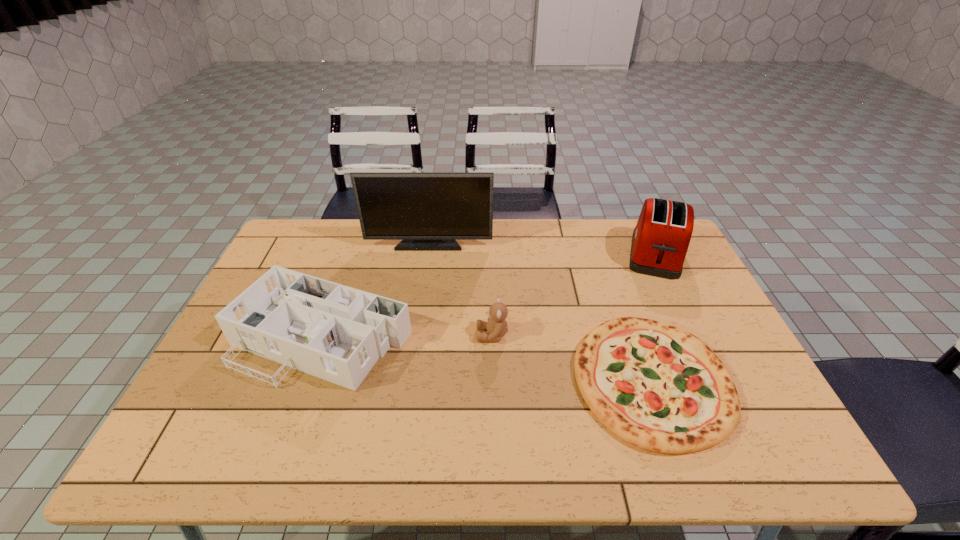
You are a GUI agent. You are given a task and a screenshot of the screen. Output one action in this format:
    pyautogui.click(x=<x>, y=<y>)
    Task: Click on the vacant point located between the pizza and the second tallest object
    The width and height of the screenshot is (960, 540).
    Given the screenshot: What is the action you would take?
    pyautogui.click(x=654, y=318)

This screenshot has width=960, height=540. Find the location of `vacant point located between the second tallest object and the teddy bear`. vacant point located between the second tallest object and the teddy bear is located at coordinates (574, 295).

Find the location of a particular element. Image resolution: width=960 pixels, height=540 pixels. empty space that is in between the second tallest object and the monitor is located at coordinates (542, 249).

Find the location of a particular element. This screenshot has height=540, width=960. vacant area between the pizza and the tallest object is located at coordinates (540, 312).

Identify which object is the fourth nearest to the teddy bear. Please provide its 2D coordinates. Your answer should be formatted as a tuple, i.e. [(x, y)], where the tuple contains the x and y coordinates of a point satisfying the conditions above.

[(660, 240)]

The image size is (960, 540). In order to click on the fourth closest object to the teddy bear in this screenshot , I will do `click(660, 240)`.

You are a GUI agent. You are given a task and a screenshot of the screen. Output one action in this format:
    pyautogui.click(x=<x>, y=<y>)
    Task: Click on the vacant region that satisfies the following two spatial constraints: 1. on the screen side of the toaster; 2. on the left side of the tallest object
    
    Given the screenshot: What is the action you would take?
    pyautogui.click(x=427, y=255)

In order to click on free space that satisfies the following two spatial constraints: 1. on the screen side of the tallest object; 2. on the right side of the shortest object in this screenshot , I will do click(409, 380).

You are a GUI agent. You are given a task and a screenshot of the screen. Output one action in this format:
    pyautogui.click(x=<x>, y=<y>)
    Task: Click on the vacant space that satisfies the following two spatial constraints: 1. on the face of the teddy bear; 2. on the right side of the shortest object
    The height and width of the screenshot is (540, 960).
    Given the screenshot: What is the action you would take?
    pyautogui.click(x=493, y=380)

Where is `vacant space that satisfies the following two spatial constraints: 1. on the front side of the toaster; 2. on the face of the teddy bear`? vacant space that satisfies the following two spatial constraints: 1. on the front side of the toaster; 2. on the face of the teddy bear is located at coordinates (694, 335).